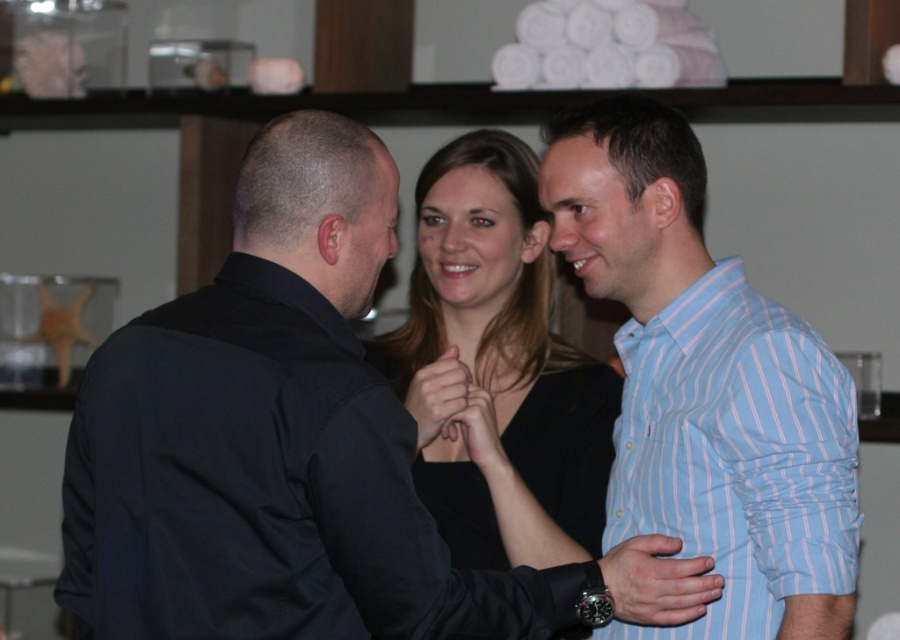
Does black matte dress at center lie in front of matte blue shirt at center?

No, it is behind matte blue shirt at center.

Is black matte dress at center shorter than matte blue shirt at center?

Incorrect, black matte dress at center's height does not fall short of matte blue shirt at center's.

The height and width of the screenshot is (640, 900). I want to click on black matte dress at center, so click(561, 442).

Is point (849, 504) positioned in front of point (650, 547)?

Yes.

Can you confirm if light blue striped shirt at right is positioned above matte blue shirt at center?

Yes.

Does point (749, 632) come closer to viewer compared to point (658, 541)?

Yes, it is.

The height and width of the screenshot is (640, 900). Identify the location of light blue striped shirt at right. tap(735, 452).

Is smooth black dress at center taller than smooth skin hand at center?

Correct, smooth black dress at center is much taller as smooth skin hand at center.

The width and height of the screenshot is (900, 640). Describe the element at coordinates (495, 353) in the screenshot. I see `smooth black dress at center` at that location.

Find the location of a particular element. smooth black dress at center is located at coordinates (495, 353).

Where is `smooth black dress at center`? This screenshot has width=900, height=640. smooth black dress at center is located at coordinates (495, 353).